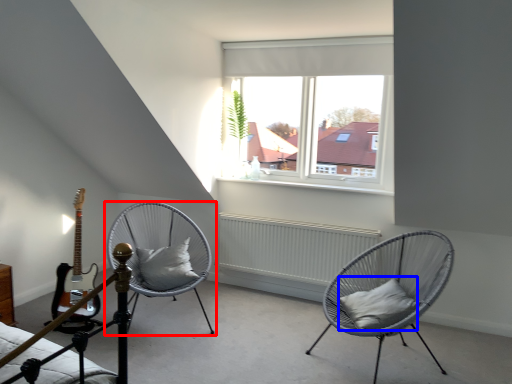
Question: Which point is closer to the camera, chair (highlighted by a red box) or pillow (highlighted by a blue box)?

Choices:
 (A) chair
 (B) pillow

Answer: (B)